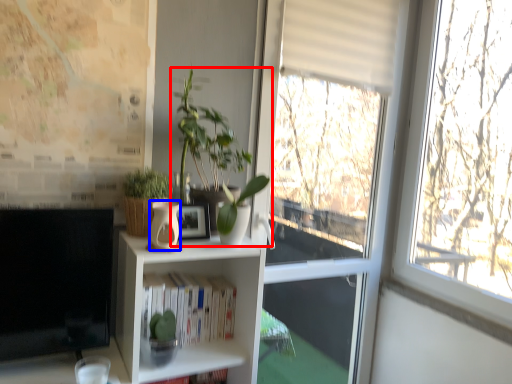
Question: Among these objects, which one is farthest to the camera, houseplant (highlighted by a red box) or vase (highlighted by a blue box)?

Choices:
 (A) houseplant
 (B) vase

Answer: (A)